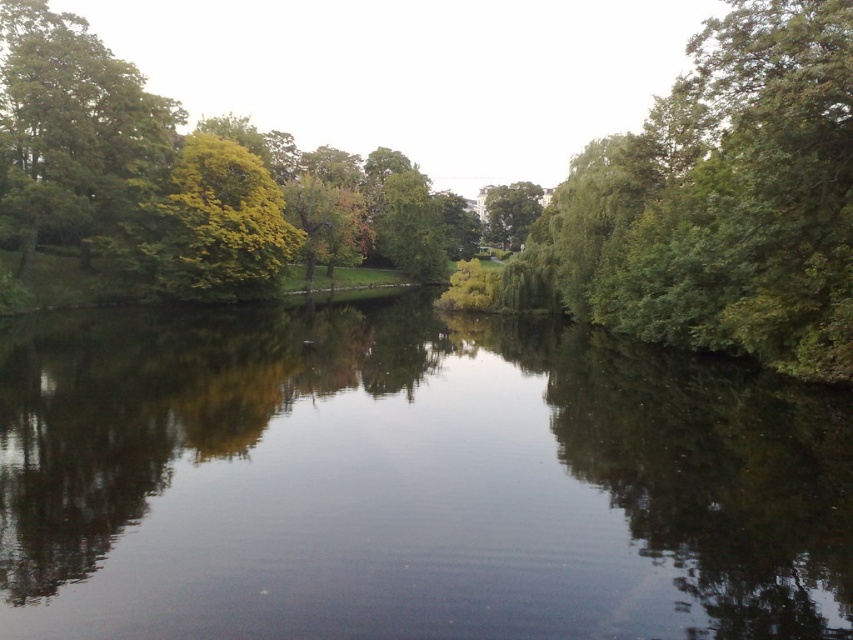
Is green leafy tree at right shorter than green leafy tree at upper left?

Yes.

Does point (711, 141) come in front of point (24, 120)?

Yes, point (711, 141) is in front of point (24, 120).

The width and height of the screenshot is (853, 640). In order to click on green leafy tree at right in this screenshot , I will do `click(726, 198)`.

Measure the distance from smooth reflective water at center to yellow-green foliage at upper left.

smooth reflective water at center and yellow-green foliage at upper left are 47.04 feet apart from each other.

Can you confirm if smooth reflective water at center is thinner than yellow-green foliage at upper left?

No.

At what (x,y) coordinates should I click in order to perform the action: click on smooth reflective water at center. Please return your answer as a coordinate pair (x, y). This screenshot has height=640, width=853. Looking at the image, I should click on (408, 481).

Identify the location of smooth reflective water at center. (408, 481).

Does smooth reflective water at center have a lesser width compared to green leafy tree at center?

Indeed, smooth reflective water at center has a lesser width compared to green leafy tree at center.

Does smooth reflective water at center appear under green leafy tree at center?

Yes, smooth reflective water at center is below green leafy tree at center.

The width and height of the screenshot is (853, 640). I want to click on smooth reflective water at center, so click(x=408, y=481).

Image resolution: width=853 pixels, height=640 pixels. I want to click on smooth reflective water at center, so click(408, 481).